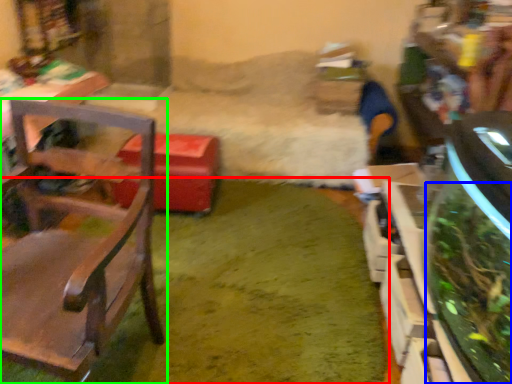
Question: Based on their relative distances, which object is farther from grass (highlighted by a red box)? Choose from plant (highlighted by a blue box) and chair (highlighted by a green box).

Choices:
 (A) plant
 (B) chair

Answer: (A)